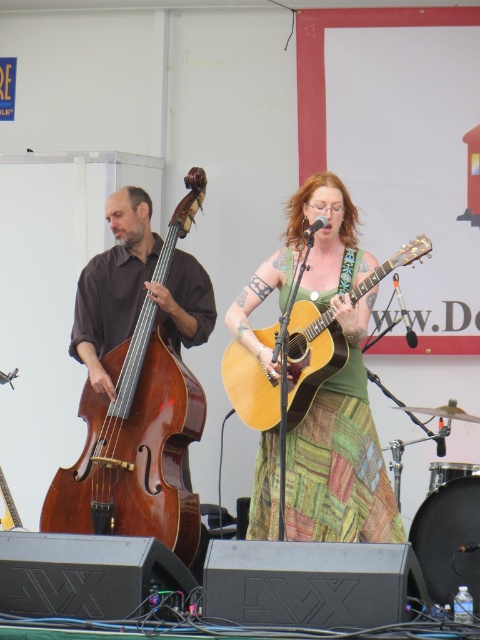
Is brown polished wood cello at left closer to camera compared to brown matte double bass at left?

Yes.

Can you confirm if brown polished wood cello at left is positioned to the left of brown matte double bass at left?

Indeed, brown polished wood cello at left is positioned on the left side of brown matte double bass at left.

Does point (134, 221) lie in front of point (122, 282)?

No, it is not.

Where is `brown polished wood cello at left`? brown polished wood cello at left is located at coordinates (137, 380).

Describe the element at coordinates (137, 380) in the screenshot. The image size is (480, 640). I see `brown polished wood cello at left` at that location.

Is brown polished wood cello at left bigger than light brown acoustic guitar at center?

Indeed, brown polished wood cello at left has a larger size compared to light brown acoustic guitar at center.

Does point (180, 216) come behind point (239, 380)?

Yes.

You are a GUI agent. You are given a task and a screenshot of the screen. Output one action in this format:
    pyautogui.click(x=<x>, y=<y>)
    Task: Click on the brown polished wood cello at left
    The image size is (480, 640).
    Given the screenshot: What is the action you would take?
    pyautogui.click(x=137, y=380)

Can you confirm if brown matte double bass at left is wider than light brown acoustic guitar at center?

In fact, brown matte double bass at left might be narrower than light brown acoustic guitar at center.

Is brown matte double bass at left above light brown acoustic guitar at center?

Yes, brown matte double bass at left is above light brown acoustic guitar at center.

Which is in front, point (180, 268) or point (396, 253)?

Point (180, 268) is in front.

Find the location of a particular element. brown matte double bass at left is located at coordinates (135, 289).